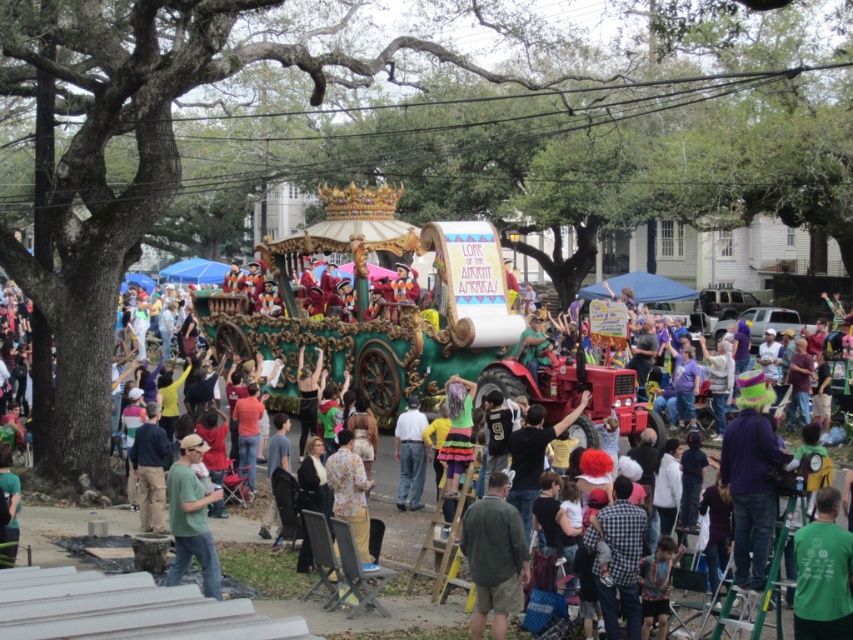
Does green cotton shirt at lower left have a greater height compared to neon green jersey at center?

Indeed, green cotton shirt at lower left has a greater height compared to neon green jersey at center.

Who is shorter, green cotton shirt at lower left or neon green jersey at center?

Standing shorter between the two is neon green jersey at center.

This screenshot has height=640, width=853. Identify the location of green cotton shirt at lower left. (190, 518).

Does green cotton shirt at center have a lesser height compared to green cotton shirt at lower left?

Correct, green cotton shirt at center is not as tall as green cotton shirt at lower left.

Is green cotton shirt at center positioned in front of green cotton shirt at lower left?

Yes, it is in front of green cotton shirt at lower left.

Is point (520, 556) closer to viewer compared to point (202, 563)?

Yes, point (520, 556) is in front of point (202, 563).

You are a GUI agent. You are given a task and a screenshot of the screen. Output one action in this format:
    pyautogui.click(x=<x>, y=<y>)
    Task: Click on the green cotton shirt at center
    This screenshot has height=640, width=853.
    Given the screenshot: What is the action you would take?
    point(494,556)

Who is more forward, (485, 572) or (833, 618)?

Point (833, 618) is more forward.

Is point (508, 557) closer to camera compared to point (845, 552)?

No, it is not.

Between point (479, 502) and point (822, 493), which one is positioned in front?

Point (822, 493) is more forward.

Find the location of a particular element. green cotton shirt at center is located at coordinates (494, 556).